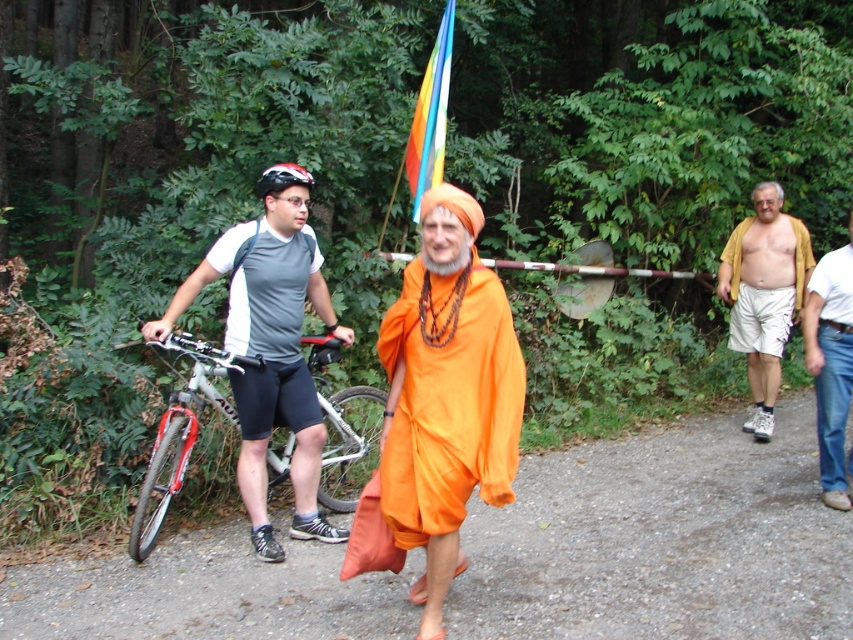
Between silver metallic bicycle at left and white cotton shirt at right, which one has less height?

With less height is silver metallic bicycle at left.

Who is more forward, (351, 416) or (817, 356)?

Point (817, 356)

Locate an element on the screen. silver metallic bicycle at left is located at coordinates (180, 433).

Is orange fabric dhoti at center positioned before white cotton shirt at right?

Yes, it is.

Between orange fabric dhoti at center and white cotton shirt at right, which one is positioned higher?

white cotton shirt at right

Between point (437, 561) and point (807, 321), which one is positioned in front?

Point (437, 561) is more forward.

The width and height of the screenshot is (853, 640). What are the coordinates of `orange fabric dhoti at center` in the screenshot? It's located at (445, 396).

Between orange fabric dhoti at center and silver metallic bicycle at left, which one is positioned lower?

silver metallic bicycle at left is lower down.

Can you confirm if orange fabric dhoti at center is bigger than silver metallic bicycle at left?

Actually, orange fabric dhoti at center might be smaller than silver metallic bicycle at left.

Who is more distant from viewer, (x=426, y=336) or (x=161, y=490)?

Point (x=161, y=490)

Identify the location of orange fabric dhoti at center. This screenshot has width=853, height=640. [445, 396].